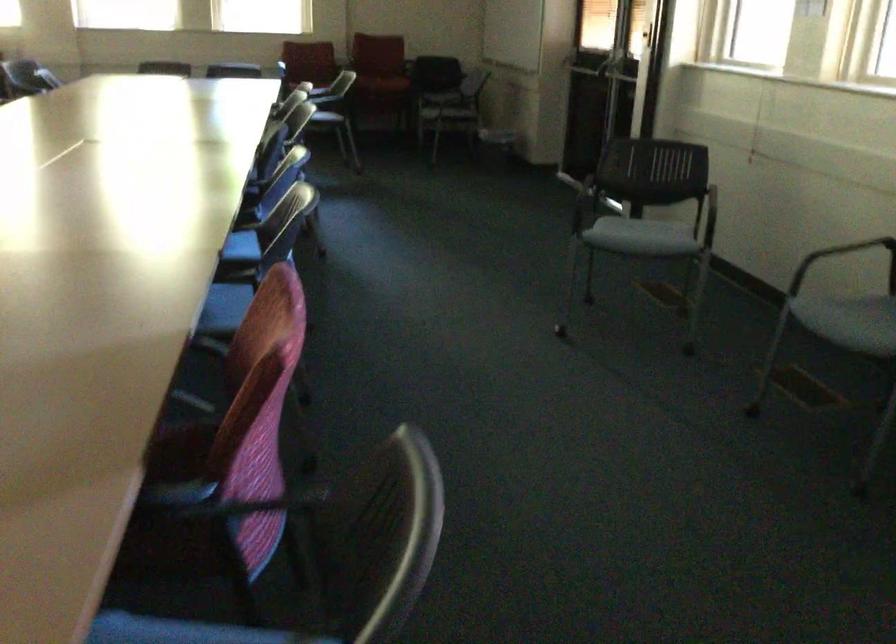
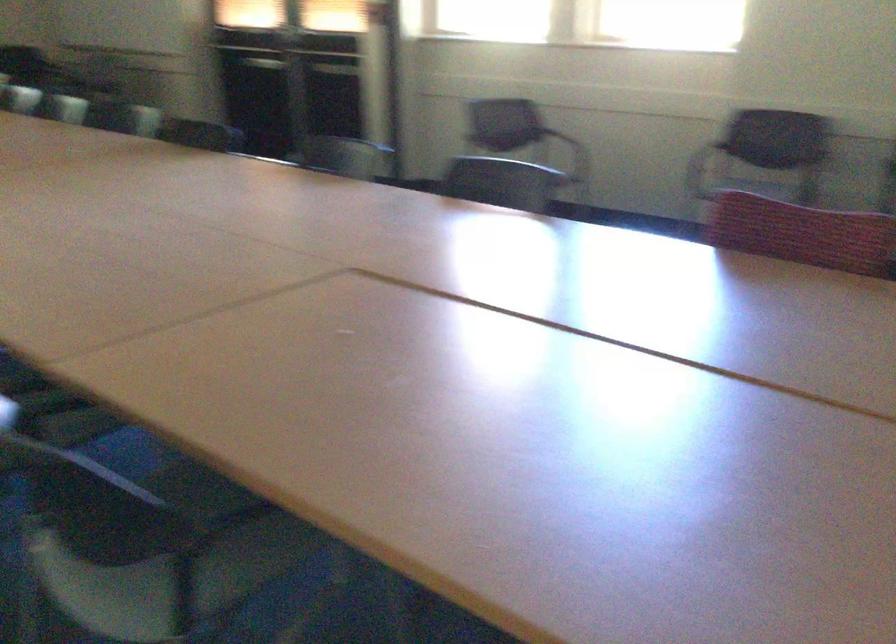
Where in the second image is the point corresponding to the point at 787,191 from the first image?

(560, 136)